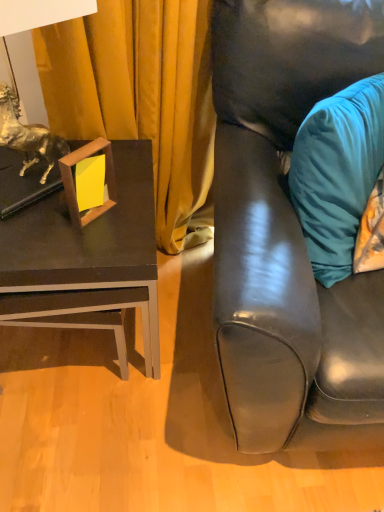
Question: Does teal velvet pillow at right contain woodenobject at left?

Choices:
 (A) yes
 (B) no

Answer: (B)

Question: Is the position of teal velvet pillow at right more distant than that of woodenobject at left?

Choices:
 (A) yes
 (B) no

Answer: (B)

Question: From a real-world perspective, is teal velvet pillow at right located beneath woodenobject at left?

Choices:
 (A) yes
 (B) no

Answer: (B)

Question: Can you confirm if teal velvet pillow at right is thinner than woodenobject at left?

Choices:
 (A) no
 (B) yes

Answer: (A)

Question: Does teal velvet pillow at right have a lesser height compared to woodenobject at left?

Choices:
 (A) yes
 (B) no

Answer: (B)

Question: Is teal velvet pillow at right to the left of woodenobject at left from the viewer's perspective?

Choices:
 (A) yes
 (B) no

Answer: (B)

Question: Is woodenobject at left beside teal velvet pillow at right?

Choices:
 (A) no
 (B) yes

Answer: (A)

Question: Considering the relative positions of woodenobject at left and teal velvet pillow at right in the image provided, is woodenobject at left to the right of teal velvet pillow at right from the viewer's perspective?

Choices:
 (A) no
 (B) yes

Answer: (A)

Question: Is woodenobject at left not close to teal velvet pillow at right?

Choices:
 (A) yes
 (B) no

Answer: (B)

Question: Can you confirm if woodenobject at left is smaller than teal velvet pillow at right?

Choices:
 (A) yes
 (B) no

Answer: (A)

Question: Is woodenobject at left behind teal velvet pillow at right?

Choices:
 (A) no
 (B) yes

Answer: (B)

Question: Can you confirm if woodenobject at left is shorter than teal velvet pillow at right?

Choices:
 (A) yes
 (B) no

Answer: (A)

Question: From a real-world perspective, does matte black couch at right sit lower than matte black table at left?

Choices:
 (A) yes
 (B) no

Answer: (B)